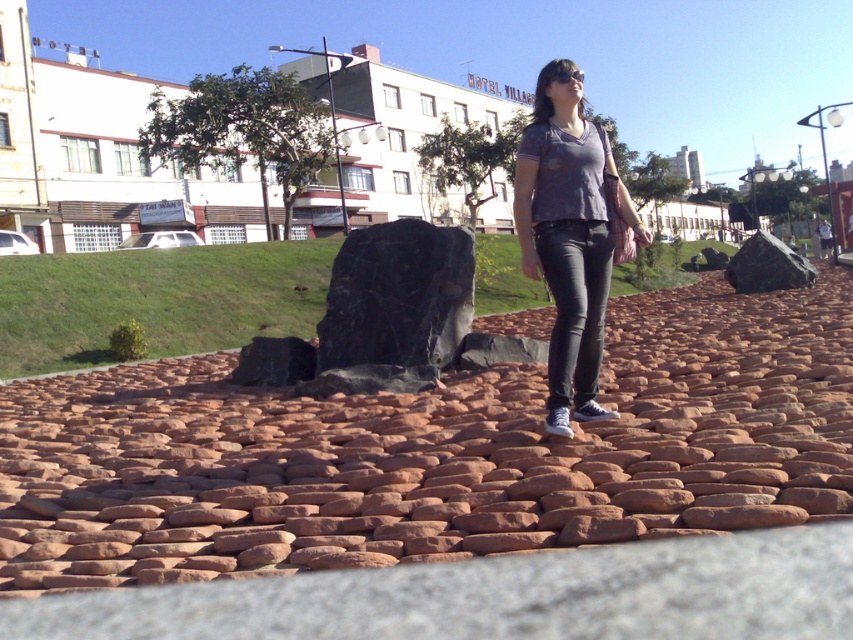
Question: Which point is farther from the camera taking this photo?

Choices:
 (A) (405, 259)
 (B) (631, 573)
 (C) (601, 168)

Answer: (A)

Question: Can you confirm if brown stone pavement at center is smaller than black smooth rock at center?

Choices:
 (A) no
 (B) yes

Answer: (B)

Question: Does red cobblestone pavement at center appear on the right side of matte gray shirt at center?

Choices:
 (A) yes
 (B) no

Answer: (B)

Question: Does brown stone pavement at center lie behind black smooth rock at center?

Choices:
 (A) yes
 (B) no

Answer: (B)

Question: Which object is positioned closest to the red cobblestone pavement at center?

Choices:
 (A) matte gray shirt at center
 (B) brown stone pavement at center

Answer: (A)

Question: Which of the following is the closest to the observer?

Choices:
 (A) (553, 401)
 (B) (769, 604)
 (C) (115, 550)
 (D) (770, 282)

Answer: (B)